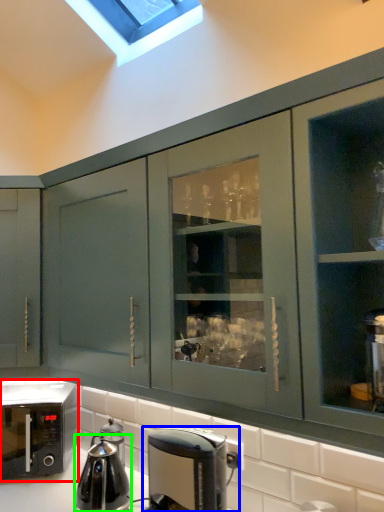
Question: Estimate the real-world distances between objects in this image. Which object is farther from home appliance (highlighted by a red box), coffee maker (highlighted by a blue box) or kitchen appliance (highlighted by a green box)?

Choices:
 (A) coffee maker
 (B) kitchen appliance

Answer: (A)